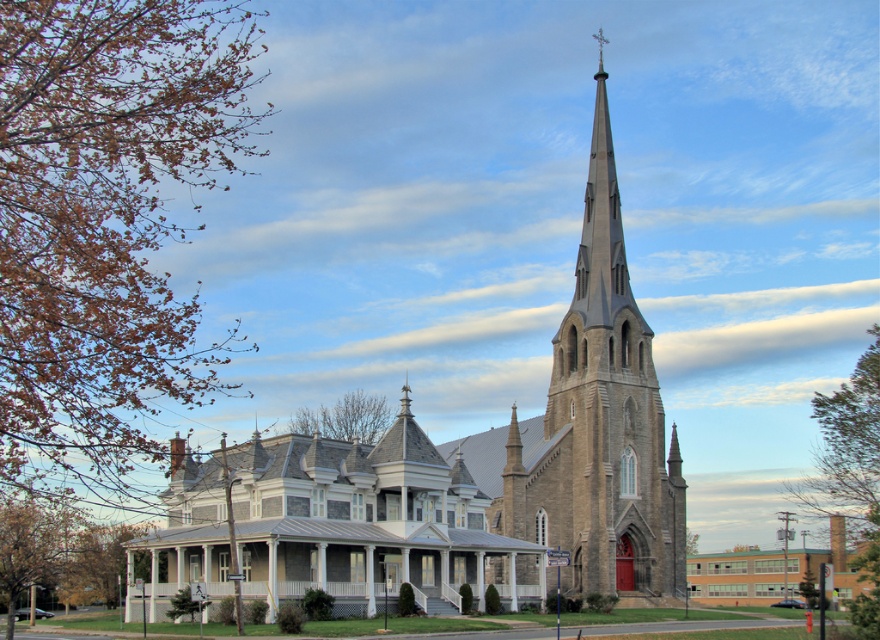
Based on the photo, does stone steeple at center have a larger size compared to gray stone church at center?

Indeed, stone steeple at center has a larger size compared to gray stone church at center.

Who is taller, stone steeple at center or gray stone church at center?

stone steeple at center

Where is `stone steeple at center`? stone steeple at center is located at coordinates 495,467.

Can you confirm if gray stone church at center is smaller than white wood porch at center?

Incorrect, gray stone church at center is not smaller in size than white wood porch at center.

Does gray stone church at center have a greater height compared to white wood porch at center?

Indeed, gray stone church at center has a greater height compared to white wood porch at center.

Measure the distance between gray stone church at center and camera.

gray stone church at center is 76.94 meters from camera.

Locate an element on the screen. Image resolution: width=880 pixels, height=640 pixels. gray stone church at center is located at coordinates (332, 524).

Is stone steeple at center bigger than white wood porch at center?

Yes, stone steeple at center is bigger than white wood porch at center.

Is stone steeple at center positioned before white wood porch at center?

That is True.

Between point (634, 529) and point (446, 605), which one is positioned in front?

Point (446, 605) is in front.

Image resolution: width=880 pixels, height=640 pixels. Identify the location of stone steeple at center. (495, 467).